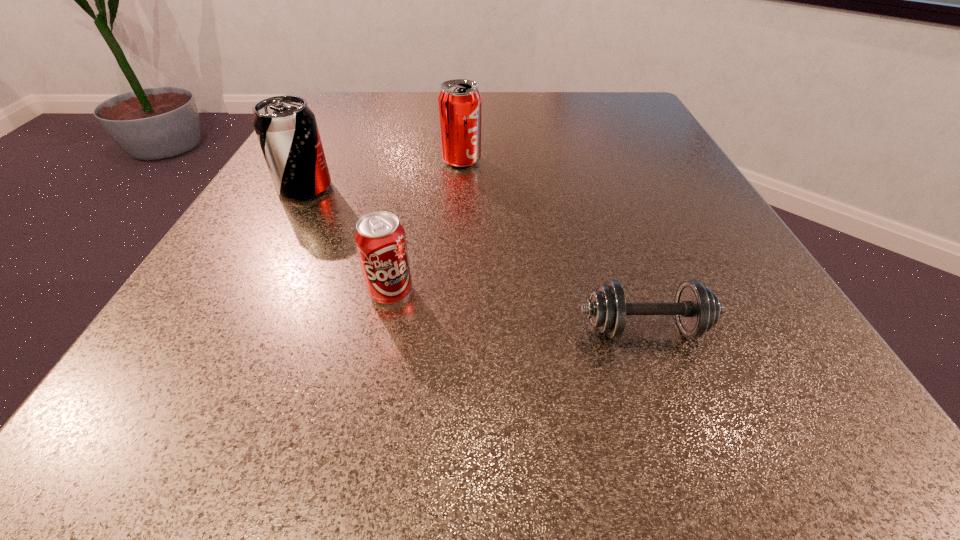
The width and height of the screenshot is (960, 540). Identify the location of vacant space in between the third object from right to left and the third object from left to right. (426, 227).

Select which object is the third closest to the second object from right to left. Please provide its 2D coordinates. Your answer should be formatted as a tuple, i.e. [(x, y)], where the tuple contains the x and y coordinates of a point satisfying the conditions above.

[(697, 309)]

Find the location of `object that stands as the closest to the dumbbell`. object that stands as the closest to the dumbbell is located at coordinates (380, 239).

Choose which soda is the second nearest neighbor to the second object from right to left. Please provide its 2D coordinates. Your answer should be formatted as a tuple, i.e. [(x, y)], where the tuple contains the x and y coordinates of a point satisfying the conditions above.

[(380, 239)]

The width and height of the screenshot is (960, 540). Identify the location of soda that stands as the third closest to the rightmost object. (286, 128).

Locate an element on the screen. Image resolution: width=960 pixels, height=540 pixels. vacant space that satisfies the following two spatial constraints: 1. on the back side of the shortest soda; 2. on the left side of the second object from right to left is located at coordinates (418, 161).